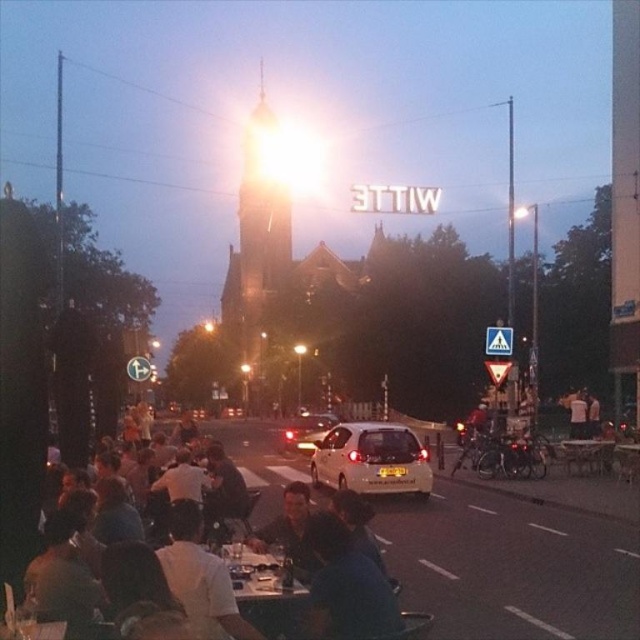
Is dark blue fabric at lower left thinner than white glossy table at center?

No.

How much distance is there between dark blue fabric at lower left and white glossy table at center?

dark blue fabric at lower left is 9.23 meters away from white glossy table at center.

Where is `dark blue fabric at lower left`? This screenshot has height=640, width=640. dark blue fabric at lower left is located at coordinates click(x=260, y=465).

Which of these two, dark blue fabric at lower left or white matte hatchback at center, stands shorter?

white matte hatchback at center

Image resolution: width=640 pixels, height=640 pixels. Identify the location of dark blue fabric at lower left. (260, 465).

Identify the location of dark blue fabric at lower left. This screenshot has height=640, width=640. (260, 465).

Which is in front, point (348, 476) or point (604, 467)?

Point (348, 476) is in front.

Between white matte hatchback at center and wooden table at center, which one has more height?

white matte hatchback at center

Between point (390, 484) and point (589, 440), which one is positioned behind?

The point (589, 440) is more distant.

This screenshot has height=640, width=640. I want to click on white matte hatchback at center, so click(x=371, y=460).